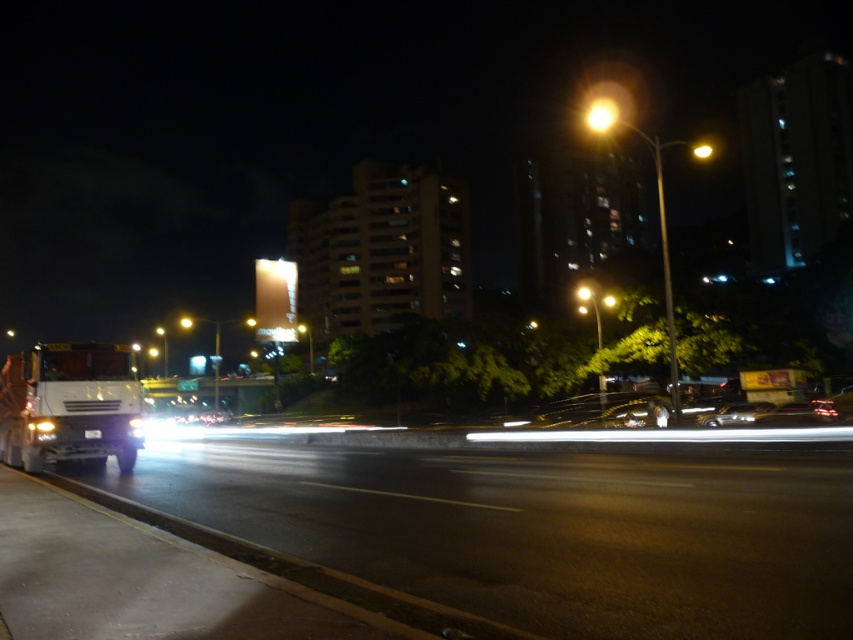
From the picture: Who is positioned more to the right, metallic silver trailer truck at left or shiny silver car at center?

Positioned to the right is shiny silver car at center.

In the scene shown: Can you confirm if metallic silver trailer truck at left is thinner than shiny silver car at center?

Yes, metallic silver trailer truck at left is thinner than shiny silver car at center.

Is point (82, 428) behind point (699, 426)?

No, it is not.

Identify the location of metallic silver trailer truck at left. (68, 404).